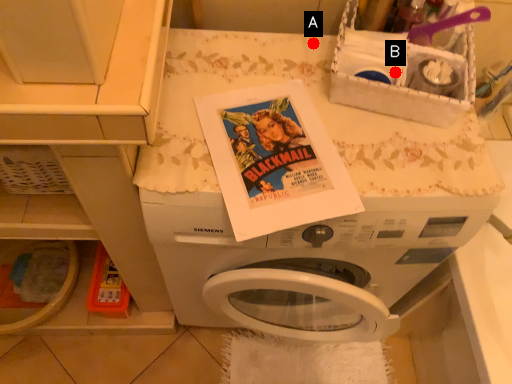
Question: Two points are circled on the image, labeled by A and B beside each circle. Which of the following is the closest to the observer?

Choices:
 (A) A is closer
 (B) B is closer

Answer: (B)